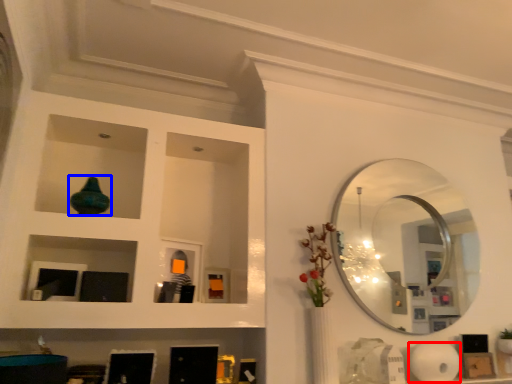
Question: Among these objects, which one is farthest to the camera, paper towel (highlighted by a red box) or glass vase (highlighted by a blue box)?

Choices:
 (A) paper towel
 (B) glass vase

Answer: (A)